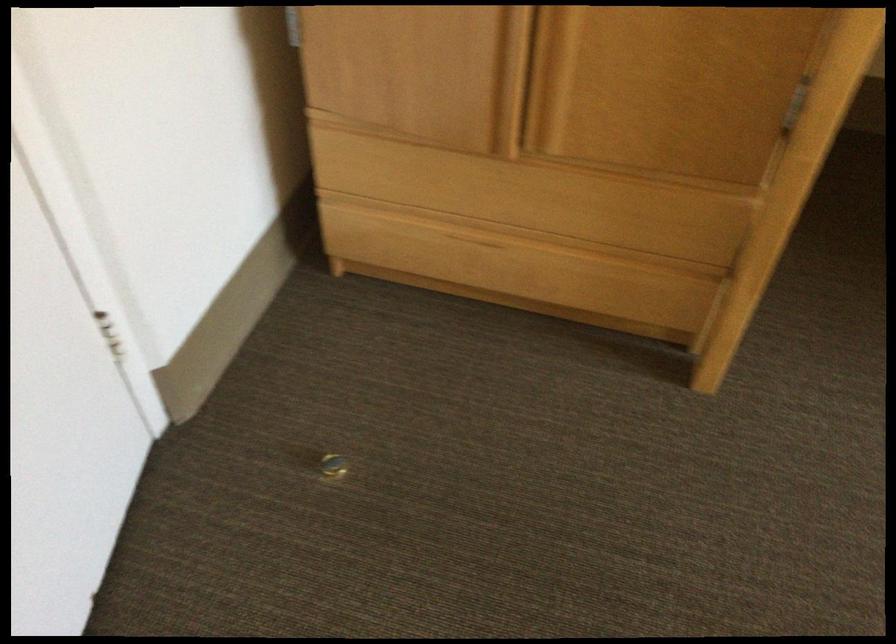
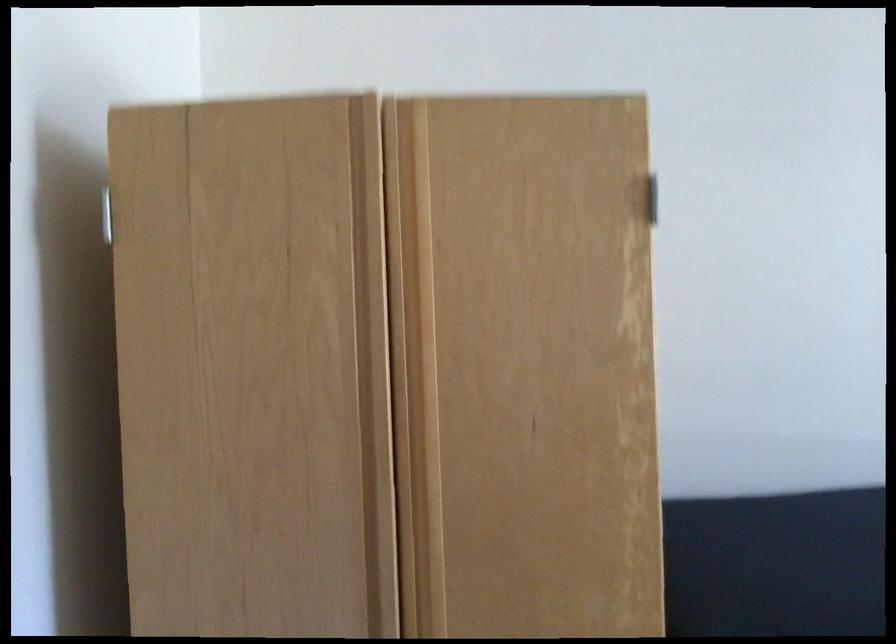
How did the camera likely rotate?

The camera rotated toward right-up.